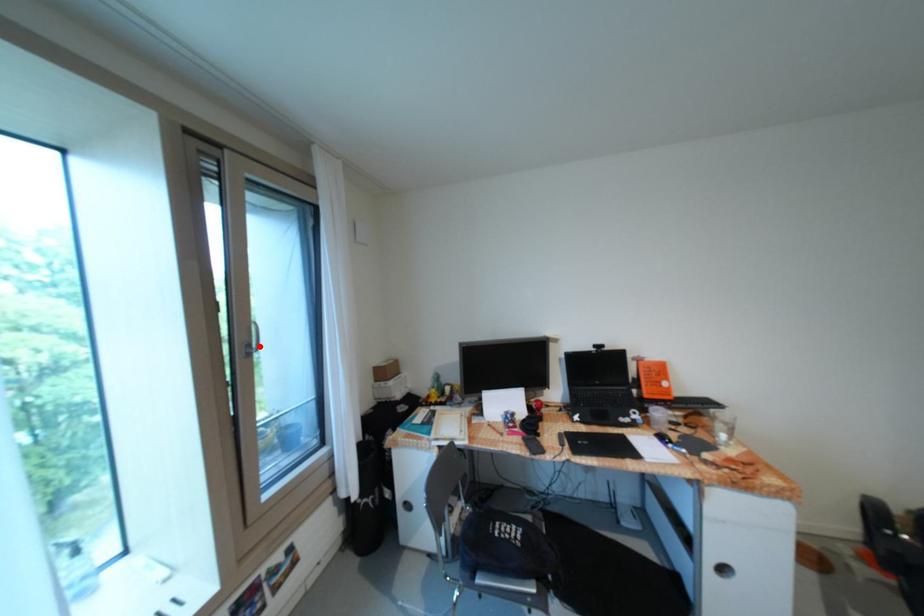
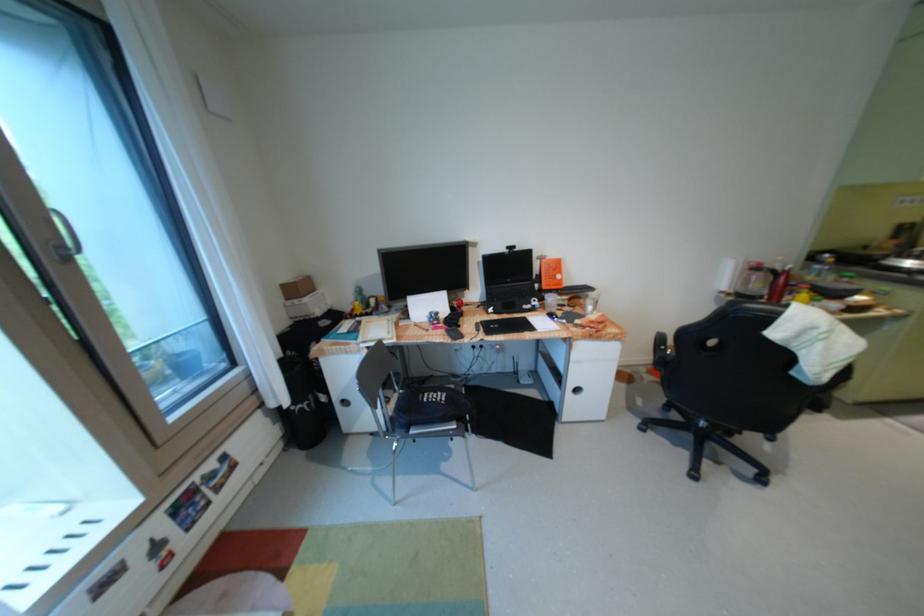
Find the pixel in the second image that matches the highlighted location in the first image.

(73, 248)